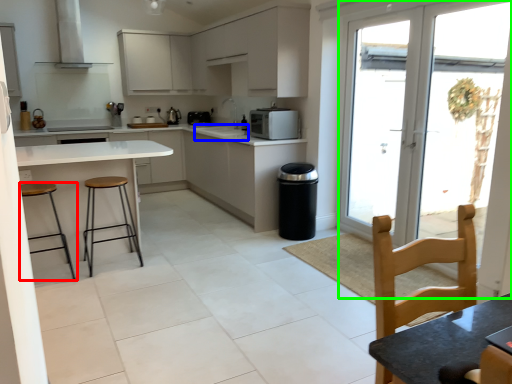
Question: Estimate the real-world distances between objects in this image. Which object is closer to stool (highlighted by a red box), sink (highlighted by a blue box) or glass door (highlighted by a green box)?

Choices:
 (A) sink
 (B) glass door

Answer: (A)